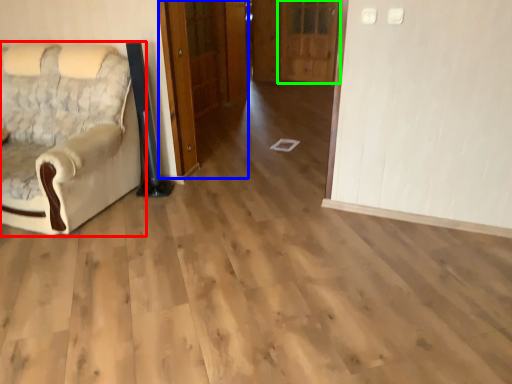
Question: Considering the real-world distances, which object is farthest from chair (highlighted by a red box)? door (highlighted by a blue box) or door (highlighted by a green box)?

Choices:
 (A) door
 (B) door

Answer: (B)